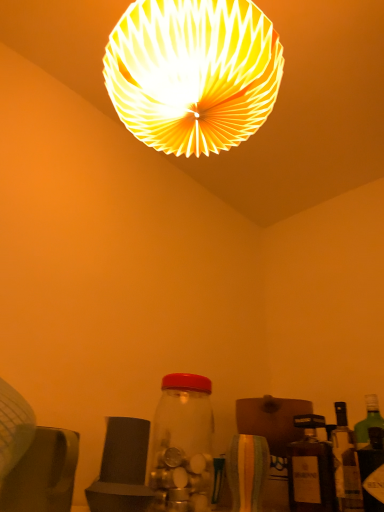
Question: Could white paper lampshade at upper center be considered to be inside transparent glass jar at center, the 3th bottle in the right-to-left sequence?

Choices:
 (A) yes
 (B) no

Answer: (B)

Question: Can you confirm if transparent glass jar at center, the first bottle when ordered from left to right, is smaller than white paper lampshade at upper center?

Choices:
 (A) no
 (B) yes

Answer: (B)

Question: Is transparent glass jar at center, the first bottle when ordered from left to right, at the left side of white paper lampshade at upper center?

Choices:
 (A) yes
 (B) no

Answer: (A)

Question: Is transparent glass jar at center, the 3th bottle in the right-to-left sequence, closer to the viewer compared to white paper lampshade at upper center?

Choices:
 (A) no
 (B) yes

Answer: (A)

Question: From a real-world perspective, is transparent glass jar at center, the 3th bottle in the right-to-left sequence, on white paper lampshade at upper center?

Choices:
 (A) no
 (B) yes

Answer: (A)

Question: Is point (200, 448) positioned closer to the camera than point (124, 78)?

Choices:
 (A) closer
 (B) farther

Answer: (B)

Question: From their relative heights in the image, would you say transparent glass jar at center, the 3th bottle in the right-to-left sequence, is taller or shorter than white paper lampshade at upper center?

Choices:
 (A) tall
 (B) short

Answer: (B)

Question: In the image, is transparent glass jar at center, the 3th bottle in the right-to-left sequence, on the left side or the right side of white paper lampshade at upper center?

Choices:
 (A) left
 (B) right

Answer: (A)

Question: From the image's perspective, relative to white paper lampshade at upper center, is transparent glass jar at center, the 3th bottle in the right-to-left sequence, above or below?

Choices:
 (A) above
 (B) below

Answer: (B)

Question: From a real-world perspective, is white paper lampshade at upper center above or below matte brown bottle at lower right, the 2th bottle positioned from the right?

Choices:
 (A) below
 (B) above

Answer: (B)

Question: Considering the positions of point (240, 110) and point (307, 426), is point (240, 110) closer or farther from the camera than point (307, 426)?

Choices:
 (A) farther
 (B) closer

Answer: (B)

Question: Considering the positions of white paper lampshade at upper center and matte brown bottle at lower right, the 2th bottle positioned from the right, in the image, is white paper lampshade at upper center taller or shorter than matte brown bottle at lower right, the 2th bottle positioned from the right,?

Choices:
 (A) short
 (B) tall

Answer: (B)

Question: Considering the positions of white paper lampshade at upper center and matte brown bottle at lower right, the 2th bottle positioned from the right, in the image, is white paper lampshade at upper center wider or thinner than matte brown bottle at lower right, the 2th bottle positioned from the right,?

Choices:
 (A) wide
 (B) thin

Answer: (A)

Question: Relative to green glass bottle at right, which is the first bottle from right to left, is white paper lampshade at upper center in front or behind?

Choices:
 (A) behind
 (B) front

Answer: (B)

Question: Choose the correct answer: Is white paper lampshade at upper center inside green glass bottle at right, the 3th bottle positioned from the left, or outside it?

Choices:
 (A) outside
 (B) inside

Answer: (A)